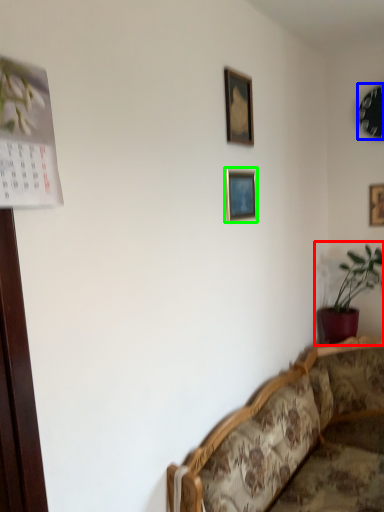
Question: Estimate the real-world distances between objects in this image. Which object is closer to houseplant (highlighted by a red box), picture frame (highlighted by a blue box) or picture frame (highlighted by a green box)?

Choices:
 (A) picture frame
 (B) picture frame

Answer: (A)